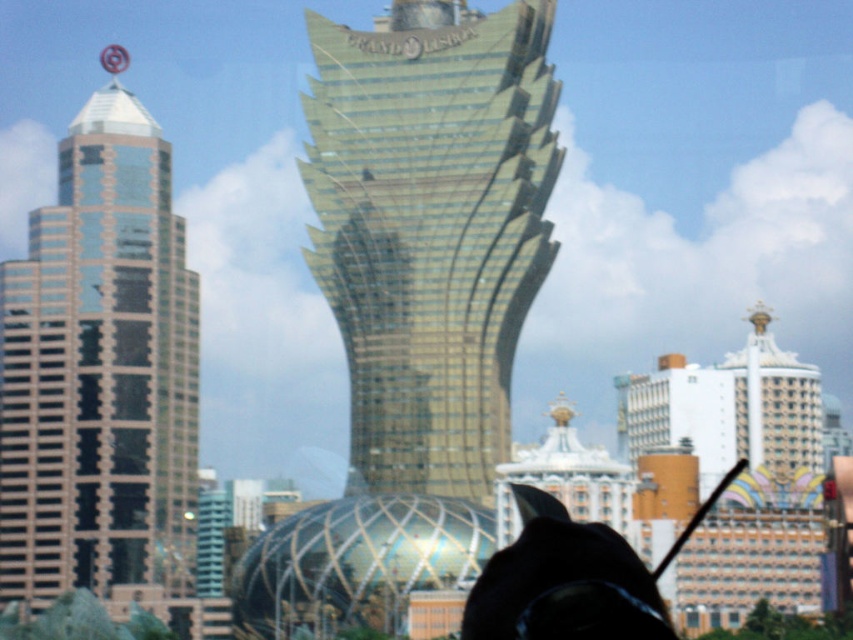
Question: Is shiny glass skyscraper at left further to camera compared to black matte hat at lower center?

Choices:
 (A) no
 (B) yes

Answer: (B)

Question: Can you confirm if black matte hat at lower center is thinner than gold metallic tower at upper right?

Choices:
 (A) no
 (B) yes

Answer: (A)

Question: In this image, where is gold glass tower at center located relative to gold metallic tower at upper right?

Choices:
 (A) right
 (B) left

Answer: (B)

Question: Which point is farther from the camera taking this photo?

Choices:
 (A) (364, 228)
 (B) (83, 420)
 (C) (605, 536)
 (D) (758, 342)

Answer: (D)

Question: Which object appears closest to the camera in this image?

Choices:
 (A) gold metallic tower at upper right
 (B) black matte hat at lower center
 (C) gold glass tower at center

Answer: (B)

Question: Which object is positioned farthest from the gold metallic tower at upper right?

Choices:
 (A) shiny glass skyscraper at left
 (B) black matte hat at lower center

Answer: (A)